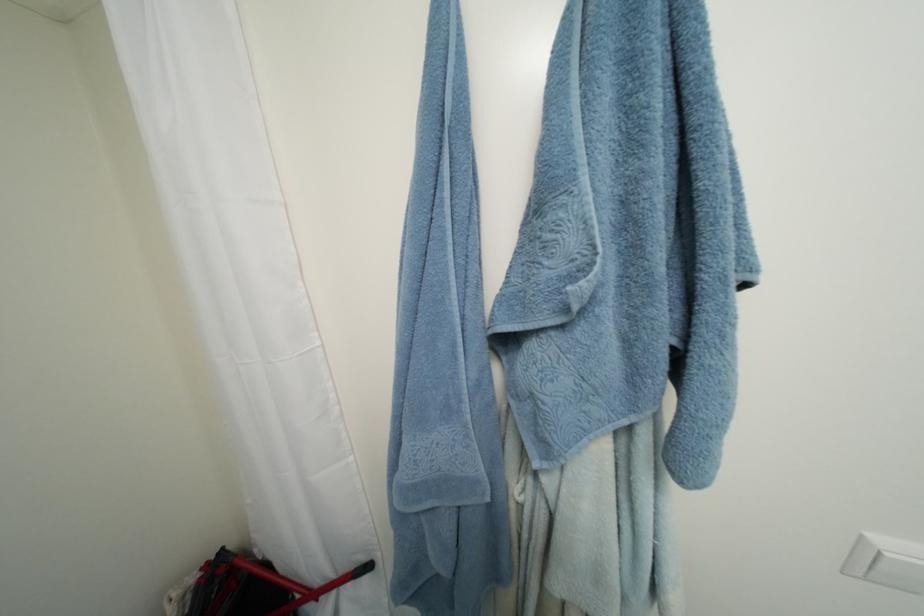
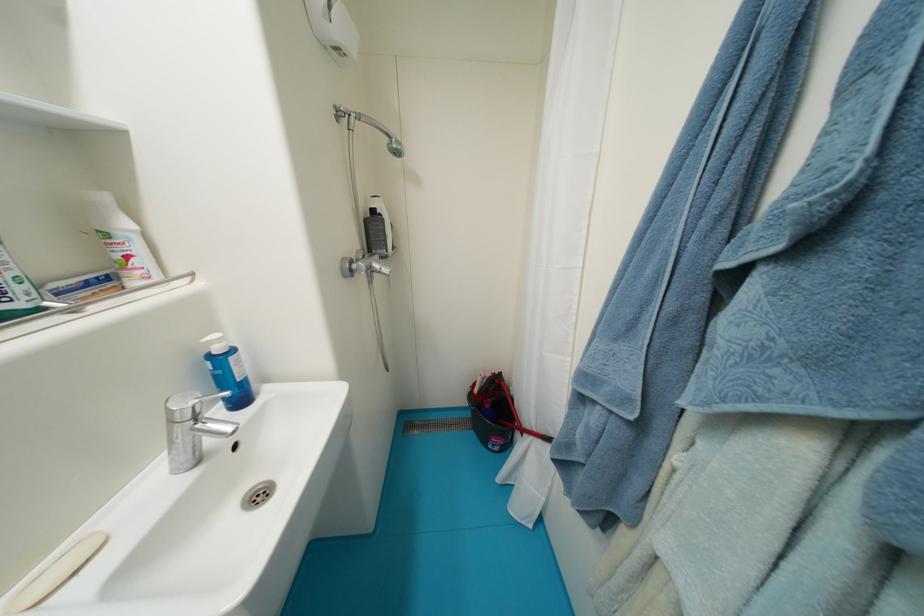
Find the pixel in the second image that matches (x=201, y=581) in the first image.

(495, 377)